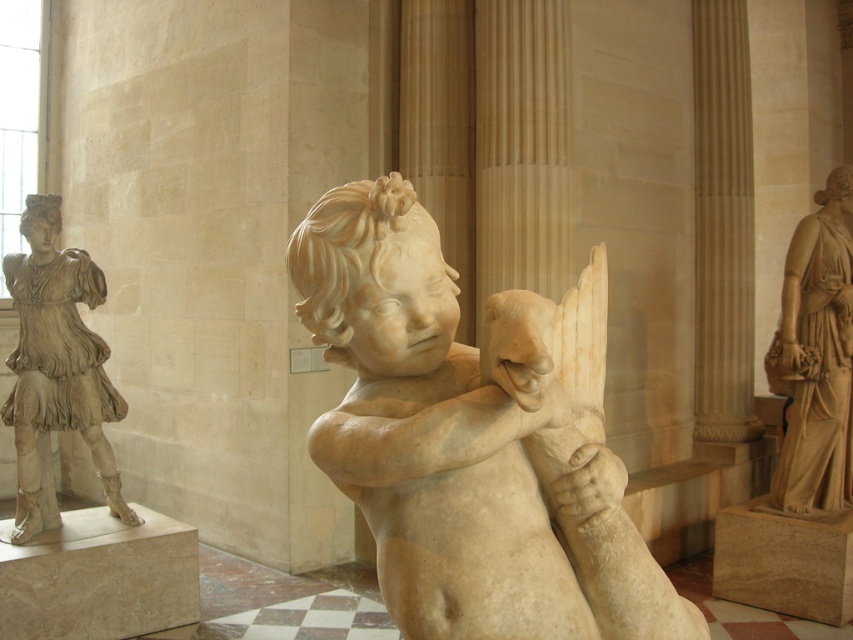
Can you confirm if matte beige statue at left is shorter than marble statue at right?

Yes.

Does point (39, 392) come behind point (801, 272)?

No, it is not.

Is point (49, 340) less distant than point (782, 392)?

Yes, point (49, 340) is closer to viewer.

This screenshot has height=640, width=853. I want to click on matte beige statue at left, so click(x=56, y=368).

From the picture: Can you confirm if white marble cherub at center is thinner than matte beige statue at left?

No.

Is white marble cherub at center above matte beige statue at left?

No, white marble cherub at center is not above matte beige statue at left.

Find the location of a particular element. white marble cherub at center is located at coordinates (465, 444).

Does point (544, 580) lie in front of point (805, 346)?

Yes, point (544, 580) is in front of point (805, 346).

Is white marble cherub at center above marble statue at right?

Incorrect, white marble cherub at center is not positioned above marble statue at right.

Which is behind, point (308, 440) or point (782, 477)?

Positioned behind is point (782, 477).

At what (x,y) coordinates should I click in order to perform the action: click on white marble cherub at center. Please return your answer as a coordinate pair (x, y). This screenshot has height=640, width=853. Looking at the image, I should click on (465, 444).